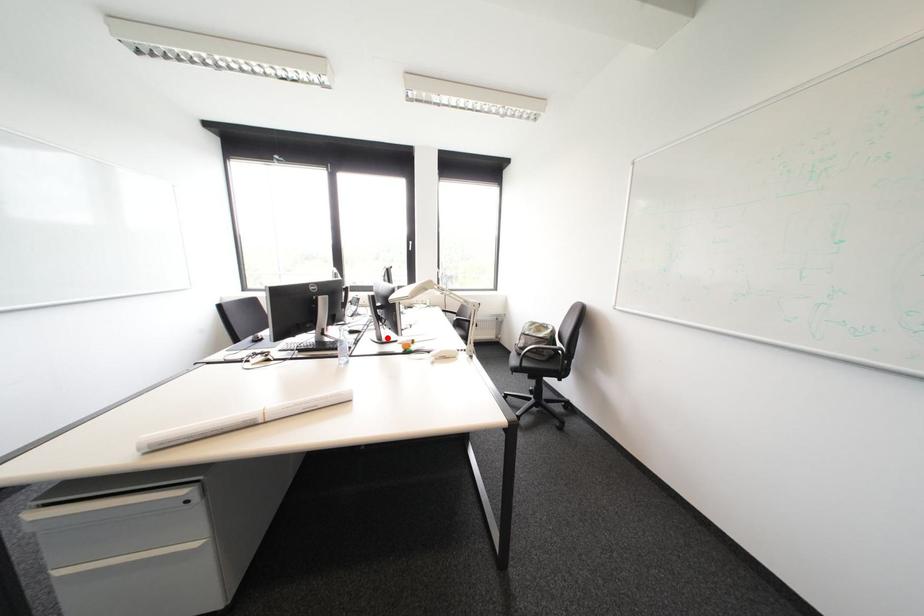
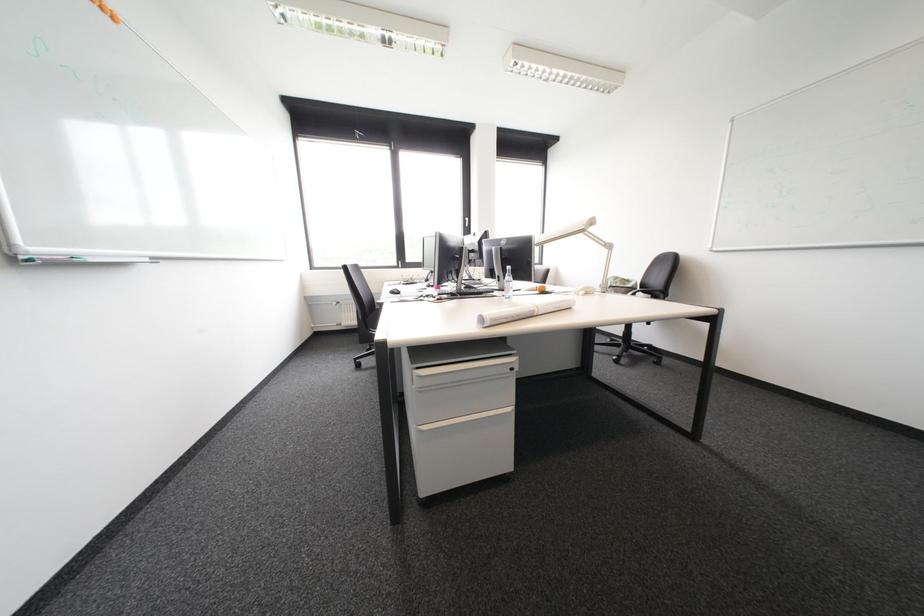
Question: A red point is marked in image1. In image2, is the corresponding 3D point closer to the camera or farther? Reply with the corresponding letter.

Choices:
 (A) The corresponding 3D point is closer.
 (B) The corresponding 3D point is farther.

Answer: (A)